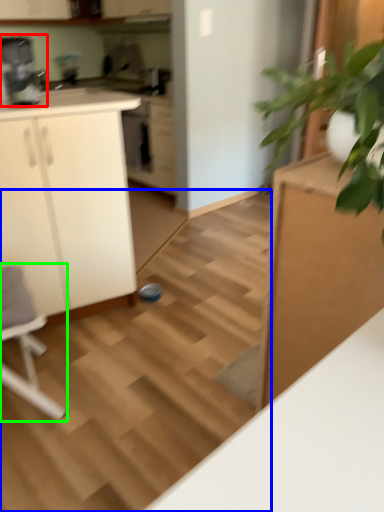
Question: Which is nearer to the coffee machine (highlighted by a red box)? stair (highlighted by a blue box) or rocking chair (highlighted by a green box).

Choices:
 (A) stair
 (B) rocking chair

Answer: (A)